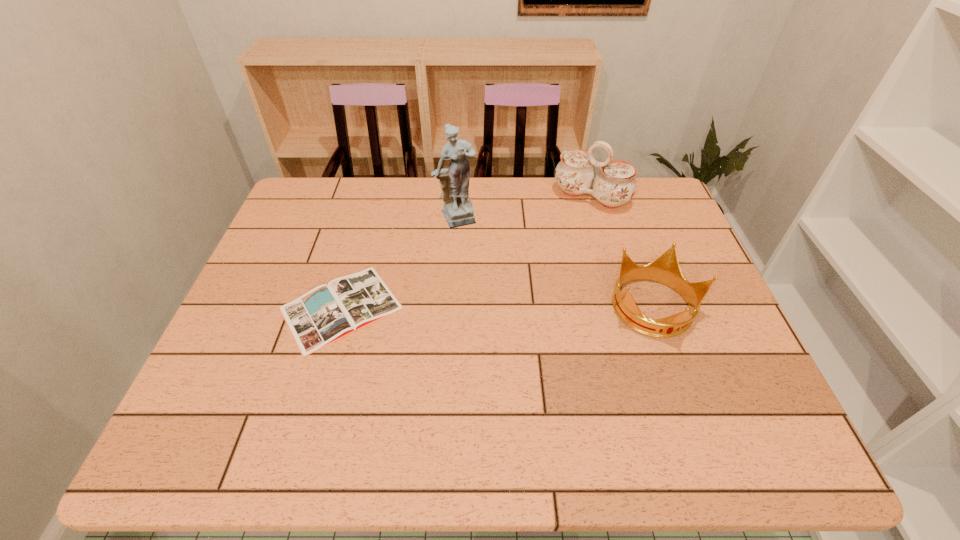
The width and height of the screenshot is (960, 540). I want to click on free space on the desktop that is between the shortest object and the third tallest object and is positioned by the handle of the chinaware, so click(516, 308).

I want to click on vacant spot on the desktop that is between the book and the crown and is positioned on the front-facing side of the tallest object, so click(x=514, y=308).